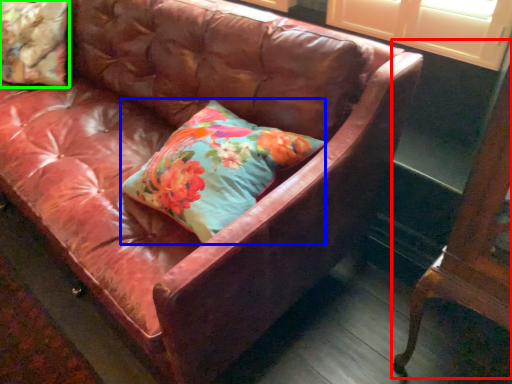
Question: Based on their relative distances, which object is nearer to furniture (highlighted by a red box)? Choose from pillow (highlighted by a blue box) and pillow (highlighted by a green box).

Choices:
 (A) pillow
 (B) pillow

Answer: (A)